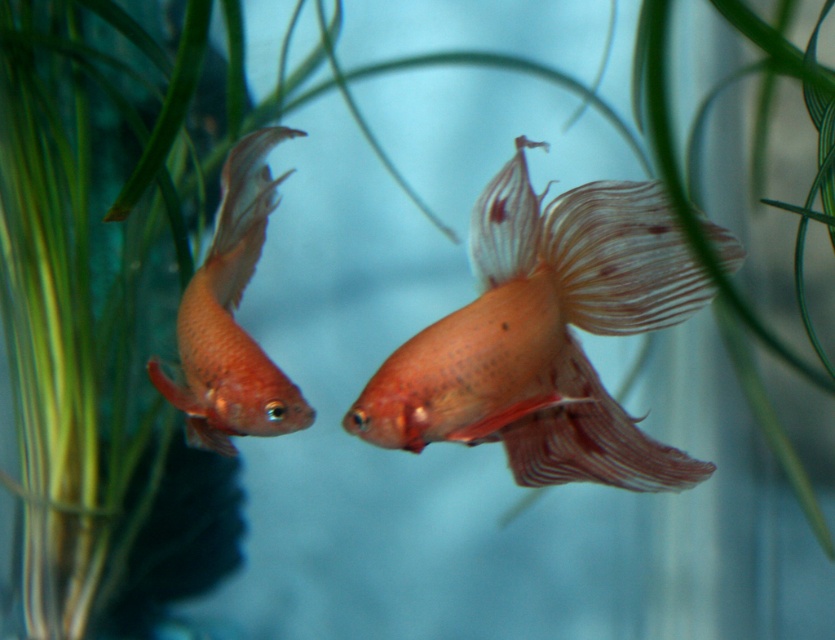
You are a robotic aquarium cleaner. You need to locate the translucent orange fish at center. What are its coordinates in the image?

The translucent orange fish at center is located at coordinates point [544,337].

You are an aquarium caretaker trying to feed the fish. You have a small fish food dispenser in your hand. Which fish, the translucent orange fish at center or the matte orange fish at left, is closer to the dispenser if the dispenser is placed exactly between them?

The translucent orange fish at center is positioned on the right side of the matte orange fish at left, so the matte orange fish at left is closer to the dispenser placed between them.

You are an aquarium caretaker observing the translucent orange fish at center and the matte orange fish at left. Which fish is positioned closer to the front of the aquarium?

The translucent orange fish at center is closer to the viewer than the matte orange fish at left, so it is positioned closer to the front of the aquarium.